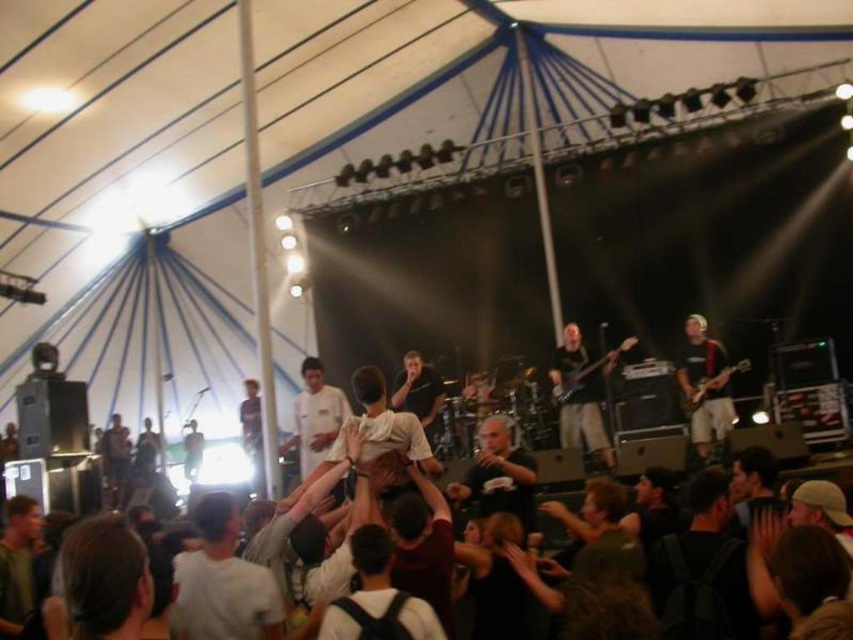
Question: Does dark gray t-shirt at center have a smaller size compared to black shirt at right?

Choices:
 (A) no
 (B) yes

Answer: (B)

Question: Can you confirm if white cotton shirt at center is positioned to the right of glossy wood guitar at upper right?

Choices:
 (A) yes
 (B) no

Answer: (B)

Question: In this image, where is dark gray t-shirt at center located relative to glossy wood guitar at upper right?

Choices:
 (A) left
 (B) right

Answer: (A)

Question: Among these objects, which one is nearest to the camera?

Choices:
 (A) white cotton shirt at center
 (B) glossy wood guitar at upper right

Answer: (A)

Question: Among these points, which one is farthest from the camera?

Choices:
 (A) (495, 474)
 (B) (744, 371)
 (C) (712, 444)

Answer: (B)

Question: Which is farther from the black matte electric guitar at center?

Choices:
 (A) white cotton shirt at center
 (B) dark gray t-shirt at center

Answer: (A)